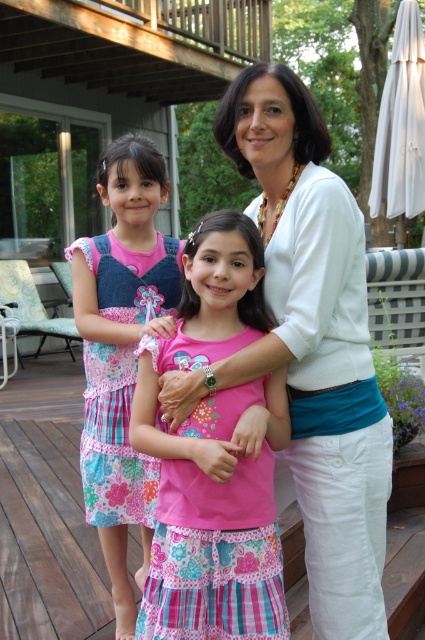
Is point (249, 161) behind point (144, 456)?

No, it is in front of (144, 456).

Can you confirm if pink cotton dress at center is positioned above floral cotton dress at center?

Yes, pink cotton dress at center is above floral cotton dress at center.

Is point (214, 124) positioned in front of point (113, 481)?

Yes.

This screenshot has width=425, height=640. I want to click on pink cotton dress at center, so click(x=309, y=346).

Between wooden deck at center and floral cotton dress at center, which one appears on the left side from the viewer's perspective?

wooden deck at center is more to the left.

Where is `wooden deck at center`? The width and height of the screenshot is (425, 640). wooden deck at center is located at coordinates (48, 538).

Image resolution: width=425 pixels, height=640 pixels. I want to click on wooden deck at center, so click(x=48, y=538).

Between pink cotton dress at center and pink fabric dress at center, which one appears on the left side from the viewer's perspective?

pink fabric dress at center is more to the left.

Is point (306, 289) in front of point (204, 428)?

Yes, point (306, 289) is in front of point (204, 428).

Does point (329, 628) come in front of point (243, 552)?

That is False.

This screenshot has height=640, width=425. Find the location of `pink cotton dress at center`. pink cotton dress at center is located at coordinates (309, 346).